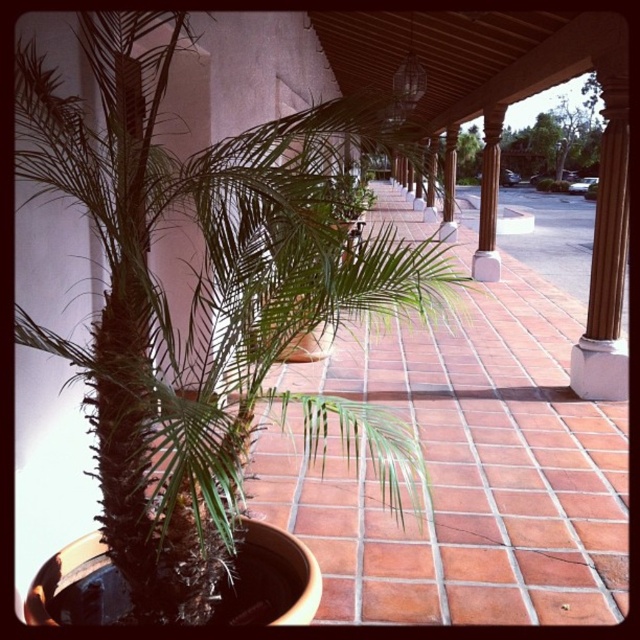
Question: Which point is farther from the camera taking this photo?

Choices:
 (A) coord(493,156)
 (B) coord(186,29)
 (C) coord(556,189)

Answer: (C)

Question: Does green leafy palm at center have a smaller size compared to brown polished wood column at center?

Choices:
 (A) yes
 (B) no

Answer: (B)

Question: Can you confirm if green leafy palm at center is thinner than brown polished wood column at center?

Choices:
 (A) yes
 (B) no

Answer: (B)

Question: Which of the following is the closest to the observer?

Choices:
 (A) green leafy plant at center
 (B) green leafy palm at center
 (C) brown polished wood column at center

Answer: (B)

Question: Which of these objects is positioned closest to the green leafy palm at center?

Choices:
 (A) brown polished wood column at center
 (B) green leafy plant at center

Answer: (A)

Question: Can you confirm if green leafy palm at center is wider than green leafy plant at center?

Choices:
 (A) no
 (B) yes

Answer: (A)